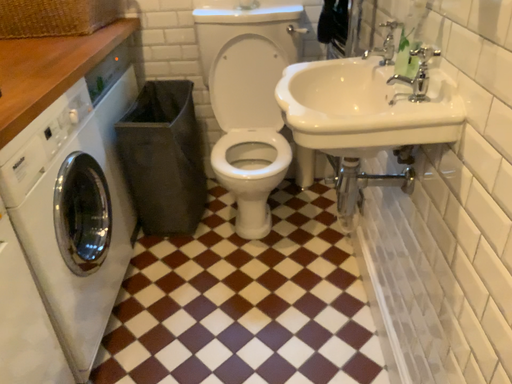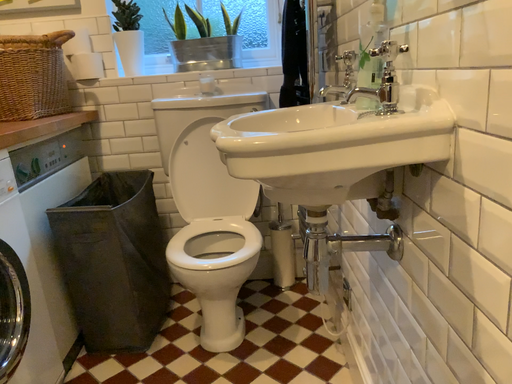
Question: How did the camera likely rotate when shooting the video?

Choices:
 (A) rotated upward
 (B) rotated downward

Answer: (A)